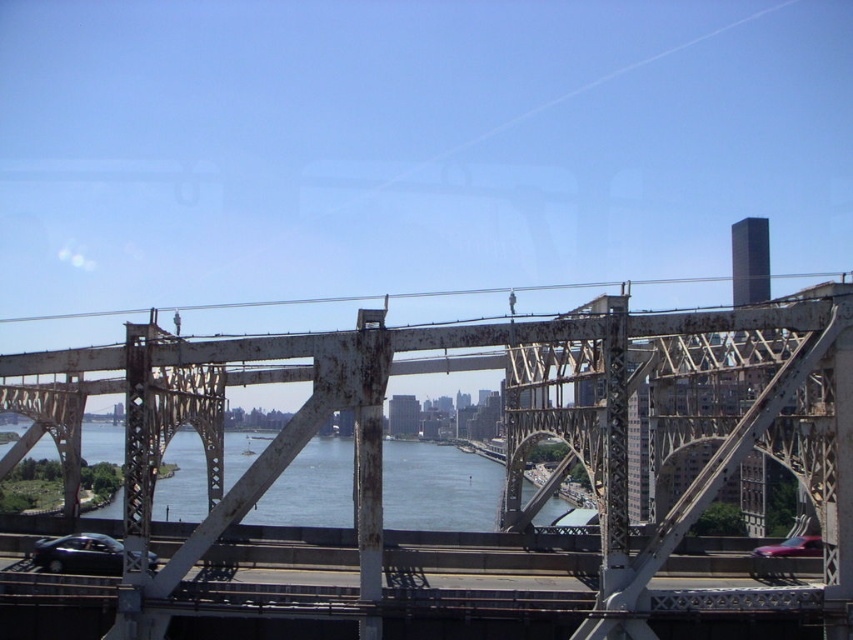
You are standing on the bridge and want to take a photo of the rusty metal bridge at center from its exact center point. What coordinates should you aim your camera at?

You should aim your camera at the coordinates point (x=521, y=440) to capture the rusty metal bridge at center from its exact center point.

You are a delivery drone that needs to fly from the rusty metal bridge at center to the shiny red car at lower right. What is the minimum distance you must cover to reach the car?

The minimum distance between the rusty metal bridge at center and the shiny red car at lower right is 23.94 meters, so the drone must cover at least 23.94 meters to reach the car.